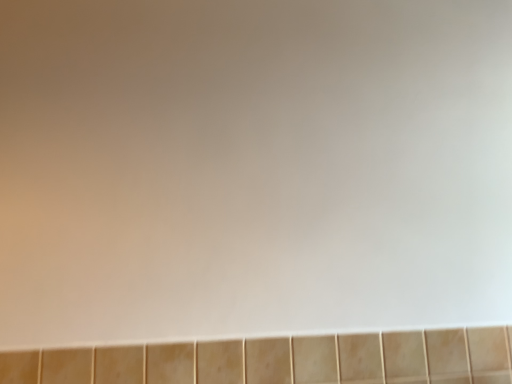
What do you see at coordinates (280, 360) in the screenshot?
I see `beige ceramic bathtub at bottom` at bounding box center [280, 360].

Where is `beige ceramic bathtub at bottom`? Image resolution: width=512 pixels, height=384 pixels. beige ceramic bathtub at bottom is located at coordinates (280, 360).

You are a GUI agent. You are given a task and a screenshot of the screen. Output one action in this format:
    pyautogui.click(x=<x>, y=<y>)
    Task: Click on the beige ceramic bathtub at bottom
    This screenshot has height=384, width=512.
    Given the screenshot: What is the action you would take?
    pyautogui.click(x=280, y=360)